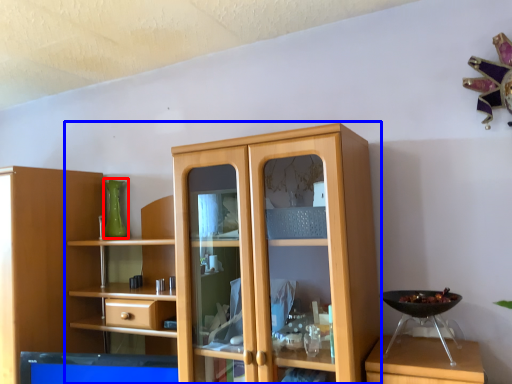
Question: Which point is further to the camera, glass vase (highlighted by a red box) or cupboard (highlighted by a blue box)?

Choices:
 (A) glass vase
 (B) cupboard

Answer: (A)